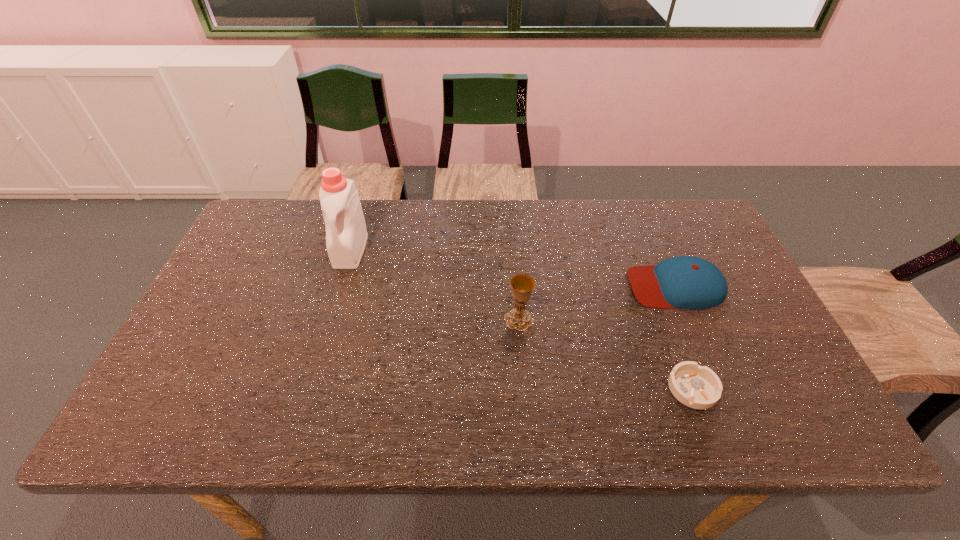
Locate an element on the screen. The height and width of the screenshot is (540, 960). vacant space positioned with the bill of the baseball cap facing forward is located at coordinates (521, 286).

Identify the location of free location located 0.260m with the bill of the baseball cap facing forward. Image resolution: width=960 pixels, height=540 pixels. (536, 286).

At what (x,y) coordinates should I click in order to perform the action: click on free spot located 0.090m on the back of the shortest object. Please return your answer as a coordinate pair (x, y). This screenshot has height=540, width=960. Looking at the image, I should click on (673, 337).

Find the location of `object that is at the far edge`. object that is at the far edge is located at coordinates (346, 236).

Identify the location of object positioned at the near edge. (698, 387).

Locate an element on the screen. The width and height of the screenshot is (960, 540). object situated at the right edge is located at coordinates (685, 282).

In the image, there is a desktop. Identify the location of free space at the far edge. (646, 207).

Identify the location of vacant space at the near edge of the desktop. (395, 404).

Find the location of a particular element. vacant space at the near left corner of the desktop is located at coordinates (204, 402).

Where is `vacant point located between the third tallest object and the chalice`? vacant point located between the third tallest object and the chalice is located at coordinates (597, 303).